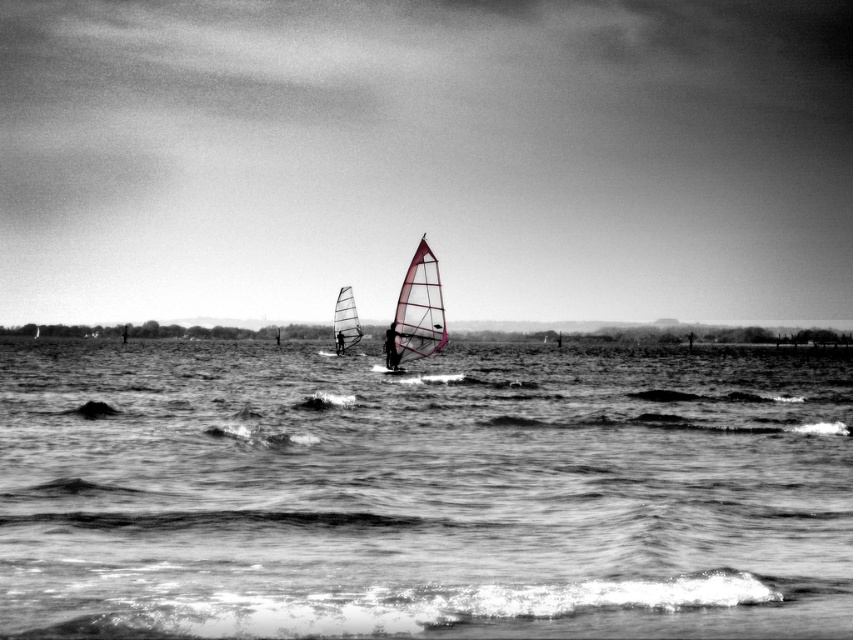
Is smooth water at center thinner than transparent plastic sail at center?

In fact, smooth water at center might be wider than transparent plastic sail at center.

Consider the image. Who is higher up, smooth water at center or transparent plastic sail at center?

transparent plastic sail at center

From the picture: Who is more distant from viewer, (402, 600) or (433, 296)?

Point (433, 296)

You are a GUI agent. You are given a task and a screenshot of the screen. Output one action in this format:
    pyautogui.click(x=<x>, y=<y>)
    Task: Click on the smooth water at center
    
    Given the screenshot: What is the action you would take?
    pyautogui.click(x=421, y=493)

Is white sail at center thinner than matte pink sail at center?

In fact, white sail at center might be wider than matte pink sail at center.

Can you confirm if white sail at center is smaller than matte pink sail at center?

No, white sail at center is not smaller than matte pink sail at center.

The height and width of the screenshot is (640, 853). In order to click on white sail at center in this screenshot , I will do `click(392, 348)`.

Is transparent plastic sail at center behind white sail at center?

No, transparent plastic sail at center is closer to the viewer.

Can you confirm if transparent plastic sail at center is bigger than white sail at center?

Indeed, transparent plastic sail at center has a larger size compared to white sail at center.

Identify the location of transparent plastic sail at center. This screenshot has height=640, width=853. (416, 310).

The image size is (853, 640). I want to click on transparent plastic sail at center, so click(416, 310).